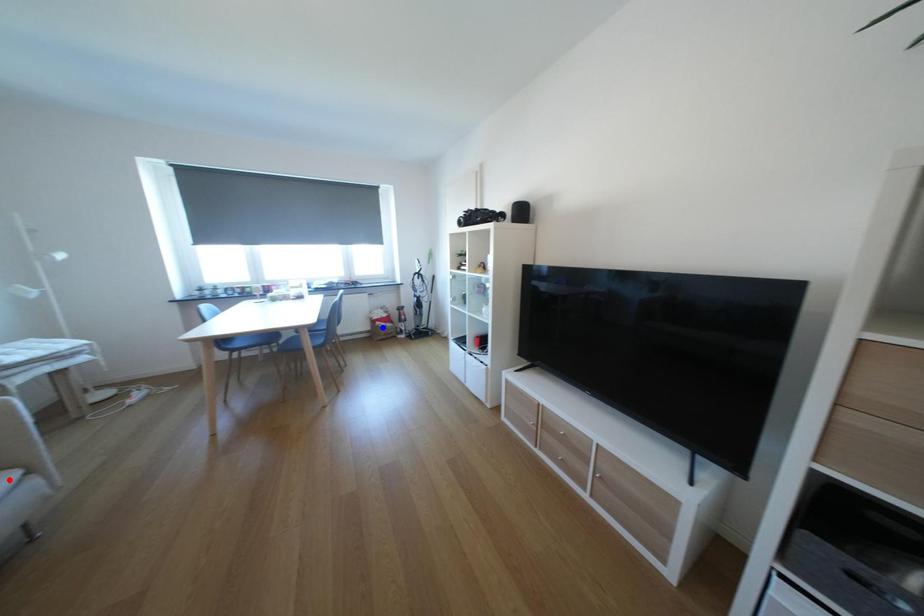
Question: Which of the two points in the image is closer to the camera?

Choices:
 (A) Blue point is closer.
 (B) Red point is closer.

Answer: (B)